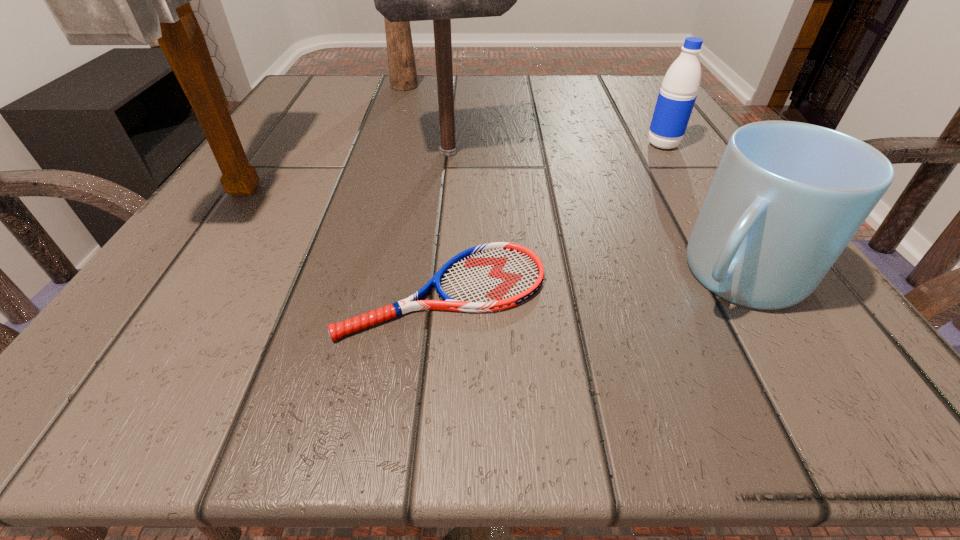
Locate an element on the screen. The width and height of the screenshot is (960, 540). object located at the far edge is located at coordinates (402, 69).

The height and width of the screenshot is (540, 960). Find the location of `object present at the near edge`. object present at the near edge is located at coordinates (494, 276).

In order to click on water bottle that is positioned at the right edge in this screenshot , I will do `click(676, 99)`.

The image size is (960, 540). In order to click on mug that is at the right edge in this screenshot , I will do `click(787, 198)`.

Find the location of `object present at the far left corner`. object present at the far left corner is located at coordinates (402, 69).

You are a GUI agent. You are given a task and a screenshot of the screen. Output one action in this format:
    pyautogui.click(x=<x>, y=<y>)
    Task: Click on the blank area at the far edge
    Image resolution: width=960 pixels, height=540 pixels.
    Given the screenshot: What is the action you would take?
    pyautogui.click(x=459, y=77)

This screenshot has width=960, height=540. I want to click on vacant space at the near edge of the desktop, so click(447, 376).

Locate an element on the screen. This screenshot has height=540, width=960. vacant area at the left edge of the desktop is located at coordinates (337, 156).

The height and width of the screenshot is (540, 960). I want to click on vacant area at the far left corner of the desktop, so click(293, 111).

Where is `vacant space at the far right corner of the desktop`? The width and height of the screenshot is (960, 540). vacant space at the far right corner of the desktop is located at coordinates (605, 86).